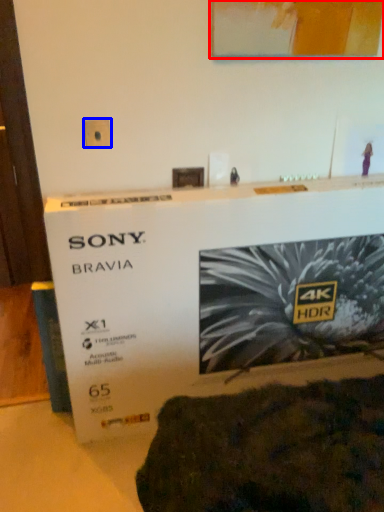
Question: Which object is closer to the camera taking this photo, picture frame (highlighted by a red box) or electric outlet (highlighted by a blue box)?

Choices:
 (A) picture frame
 (B) electric outlet

Answer: (A)